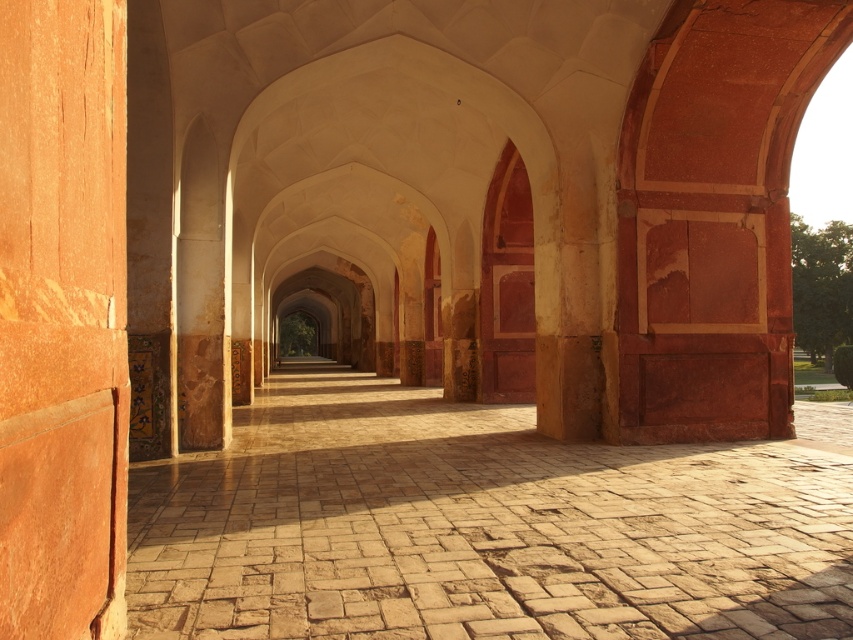
Between brown stone path at center and smooth orange stone pillar at left, which one is positioned higher?

Positioned higher is smooth orange stone pillar at left.

Does brown stone path at center have a larger size compared to smooth orange stone pillar at left?

Correct, brown stone path at center is larger in size than smooth orange stone pillar at left.

Who is more distant from viewer, (561, 481) or (1, 324)?

The point (561, 481) is behind.

Image resolution: width=853 pixels, height=640 pixels. I want to click on brown stone path at center, so click(479, 525).